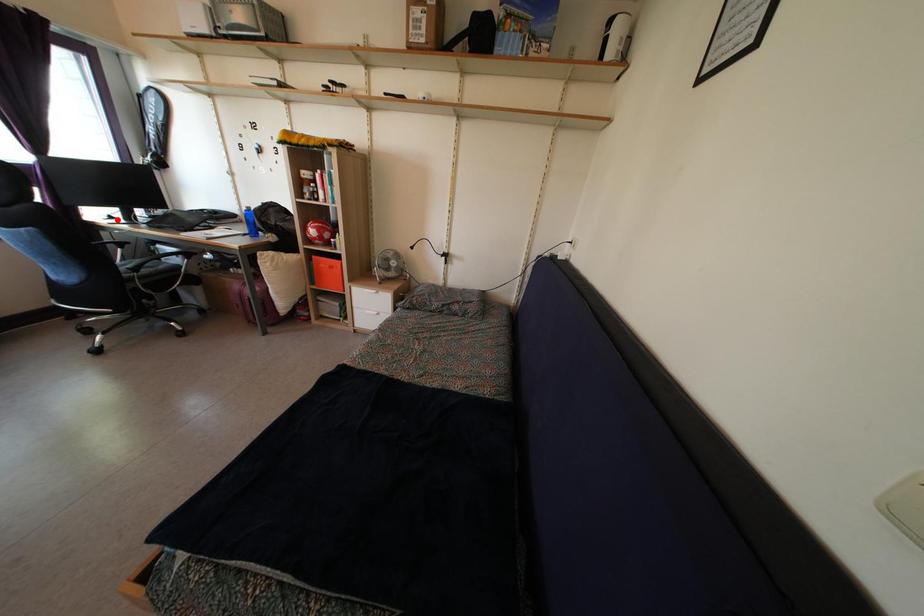
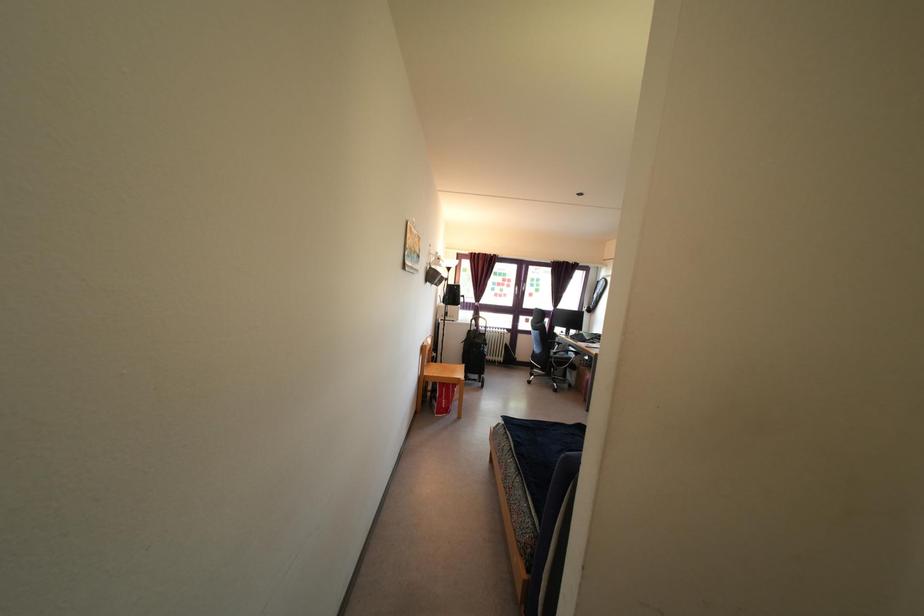
The point at the highlighted location is marked in the first image. Where is the corresponding point in the second image?

(566, 338)